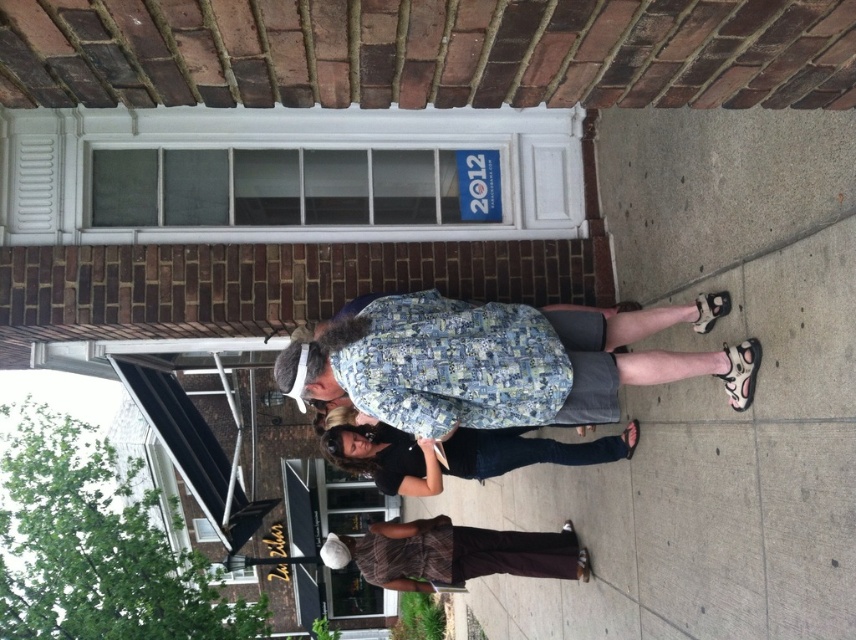
You are standing on the sidewalk in front of the brick building and see the patterned fabric jacket at center. Can you estimate the jacket

The patterned fabric jacket at center is located at point (x=502, y=362), which is in the central area of the image. Based on the coordinates provided, the jacket is positioned centrally and likely within a typical standing human height range, so it should be visible from your current position on the sidewalk.